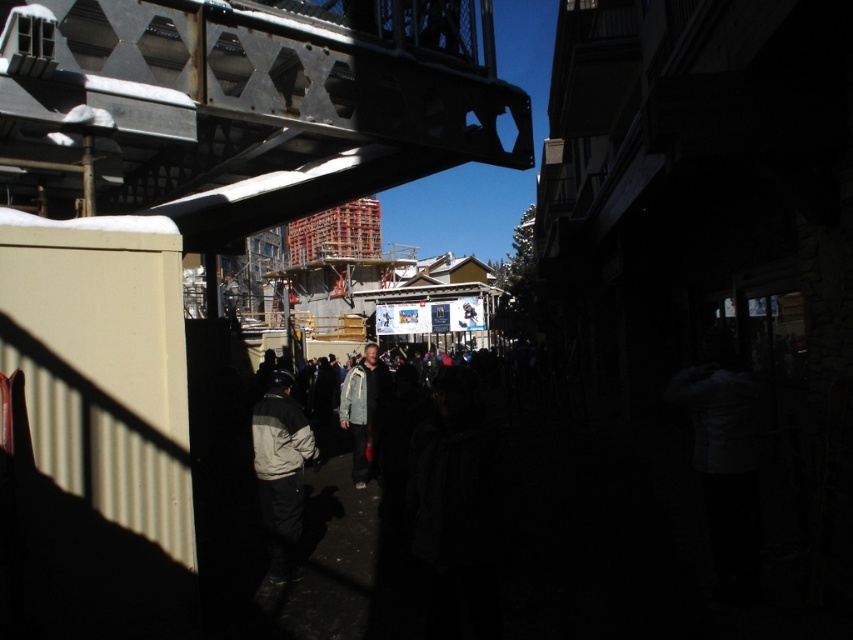
Describe the element at coordinates (280, 472) in the screenshot. I see `gray fleece jacket at center` at that location.

Does point (271, 515) come behind point (352, 422)?

No, it is not.

Where is `gray fleece jacket at center`? This screenshot has width=853, height=640. gray fleece jacket at center is located at coordinates (280, 472).